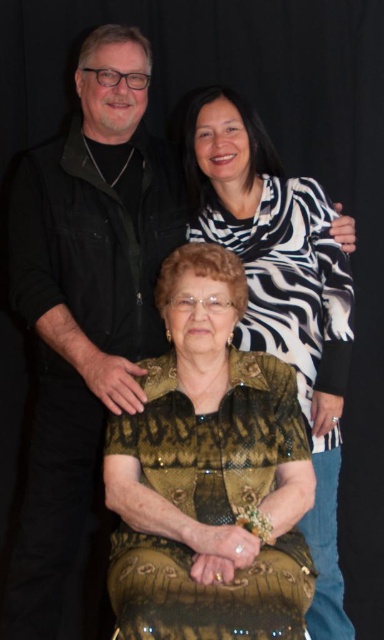
Based on the scene description, which object is larger in size between the matte black vest at upper left and the gold textured dress at center?

The gold textured dress at center is larger than the matte black vest at upper left.

What is located at the coordinates point (210, 474) in the image?

The gold textured blouse at center is located at point (210, 474).

You are a fashion designer observing the image. You need to determine which piece of clothing has a greater width between the gold textured blouse at center and the matte black vest at upper left. Which one is wider?

The gold textured blouse at center has a greater width than the matte black vest at upper left according to the description provided.